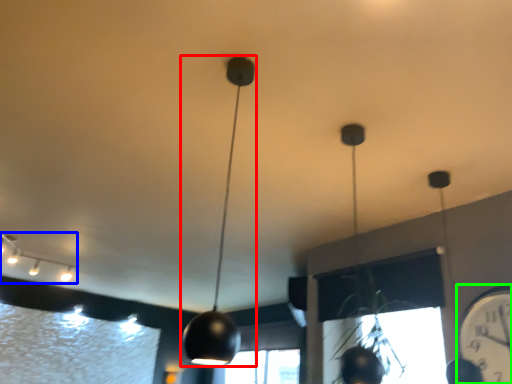
Question: Based on their relative distances, which object is nearer to lamp (highlighted by a red box)? Choose from lamp (highlighted by a blue box) and clock (highlighted by a green box).

Choices:
 (A) lamp
 (B) clock

Answer: (B)